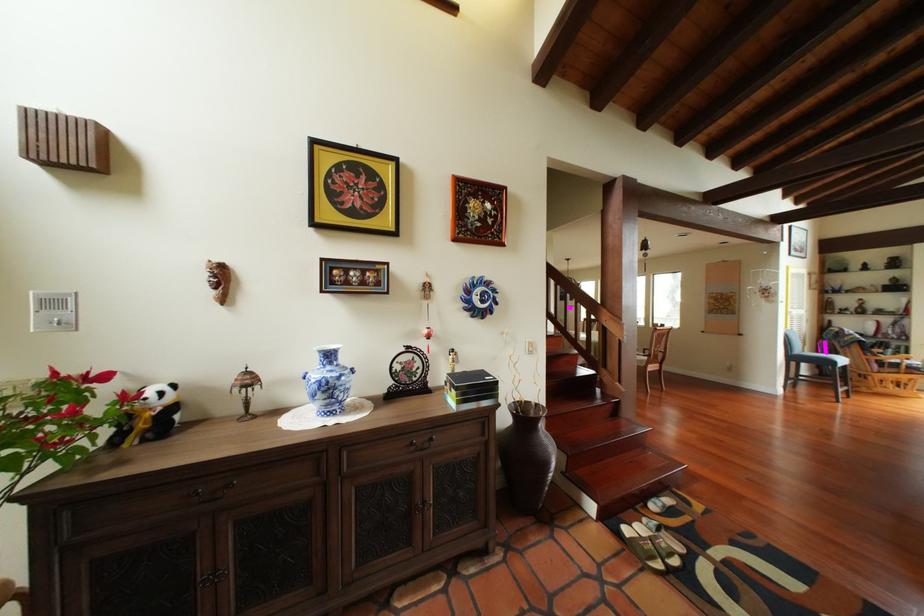
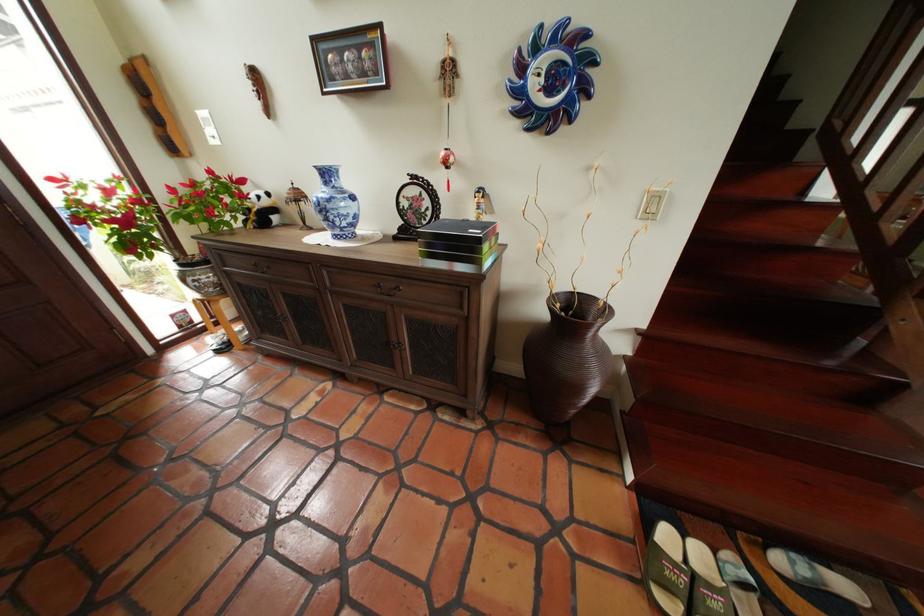
Find the pixel in the second image that matches (x=429, y=378) in the first image.

(438, 221)